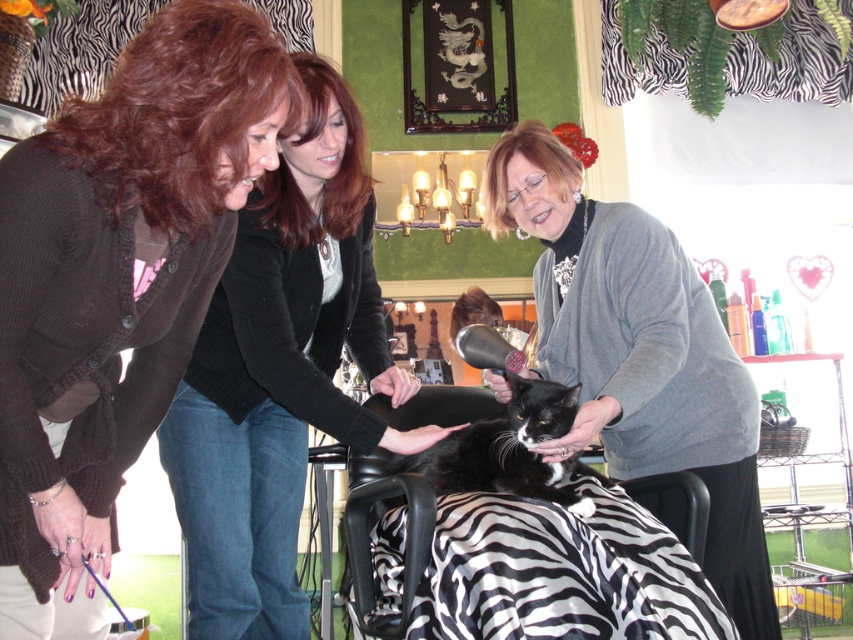
Does black sweater at center appear on the right side of gray sweater at center?

In fact, black sweater at center is to the left of gray sweater at center.

Locate an element on the screen. This screenshot has height=640, width=853. black sweater at center is located at coordinates (280, 372).

Who is more distant from viewer, (x=405, y=394) or (x=593, y=368)?

Point (x=405, y=394)

Image resolution: width=853 pixels, height=640 pixels. Find the location of `black sweater at center`. black sweater at center is located at coordinates click(280, 372).

Who is more forward, (401, 564) or (575, 168)?

Point (401, 564) is in front.

Does point (387, 561) lie in front of point (515, 141)?

Yes, it is.

Which is behind, point (556, 588) or point (529, 147)?

The point (529, 147) is more distant.

What are the coordinates of `zebra-patterned fabric at center` in the screenshot? It's located at (558, 572).

Is brown smooth hair at center further to the viewer compared to brown fuzzy hair at upper center?

No.

Measure the distance between point (343,154) and camera.

A distance of 1.86 meters exists between point (343,154) and camera.

This screenshot has width=853, height=640. Find the location of `brown smooth hair at center`. brown smooth hair at center is located at coordinates (325, 179).